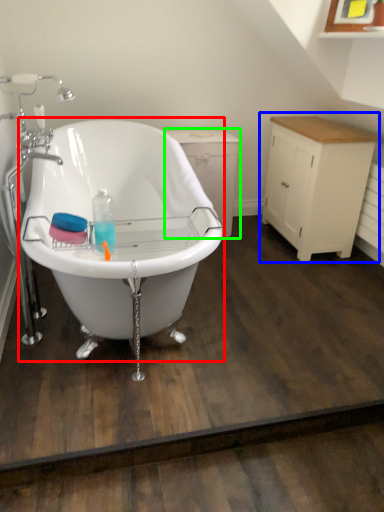
Question: Which object is the farthest from bathtub (highlighted by a red box)? Choose among these: cabinetry (highlighted by a blue box) or dresser (highlighted by a green box).

Choices:
 (A) cabinetry
 (B) dresser

Answer: (A)